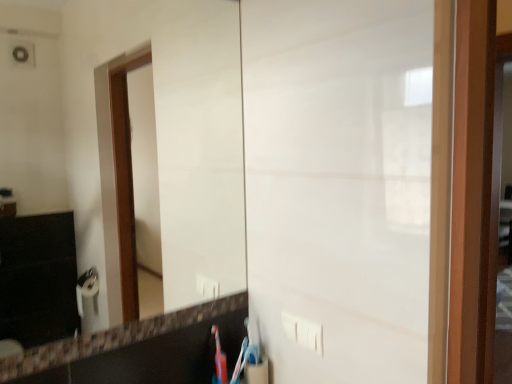
Question: Visually, is white plastic electric outlet at lower center positioned to the left or to the right of blue plastic toothbrush at lower center?

Choices:
 (A) right
 (B) left

Answer: (A)

Question: From a real-world perspective, is white plastic electric outlet at lower center physically located above or below blue plastic toothbrush at lower center?

Choices:
 (A) above
 (B) below

Answer: (A)

Question: Which object is the farthest from the blue plastic toothbrush at lower center?

Choices:
 (A) white glossy mirror at center
 (B) white plastic electric outlet at lower center

Answer: (A)

Question: Which object is the farthest from the blue plastic toothbrush at lower center?

Choices:
 (A) white plastic electric outlet at lower center
 (B) white glossy mirror at center

Answer: (B)